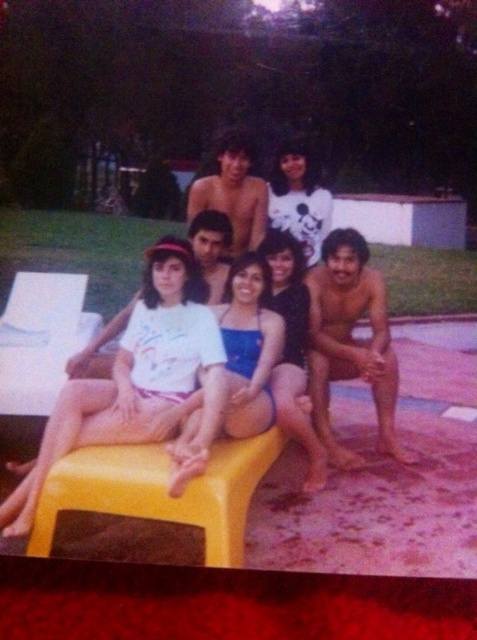
You are standing in the pool area and want to place a small decorative item. You have two options to choose from. The first option is to place it at point (138, 452), and the second option is to place it at point (237, 300). Which point is closer to you?

Point (138, 452) is closer to the viewer than point (237, 300).

You are a photographer trying to capture a group photo of the people in the pool area. You need to ensure that the white matte swimsuit at center and the white cotton shirt at upper center are both clearly visible in the frame. Given their distance apart, do you think you can fit both into a single photo without zooming in or out?

The white matte swimsuit at center is 4.35 feet away from the white cotton shirt at upper center. Since 4.35 feet is a manageable distance for a standard camera lens, you can likely capture both subjects in a single frame without needing to adjust the zoom.

Consider the image. You are organizing a swimwear fashion show and need to ensure that the models are arranged by the size of their swimwear. Given that the white matte swimsuit at center is larger than the matte black bikini top at center, which swimwear should be placed first in the sequence if we start with the largest?

The white matte swimsuit at center should be placed first in the sequence since it has a larger size compared to the matte black bikini top at center.